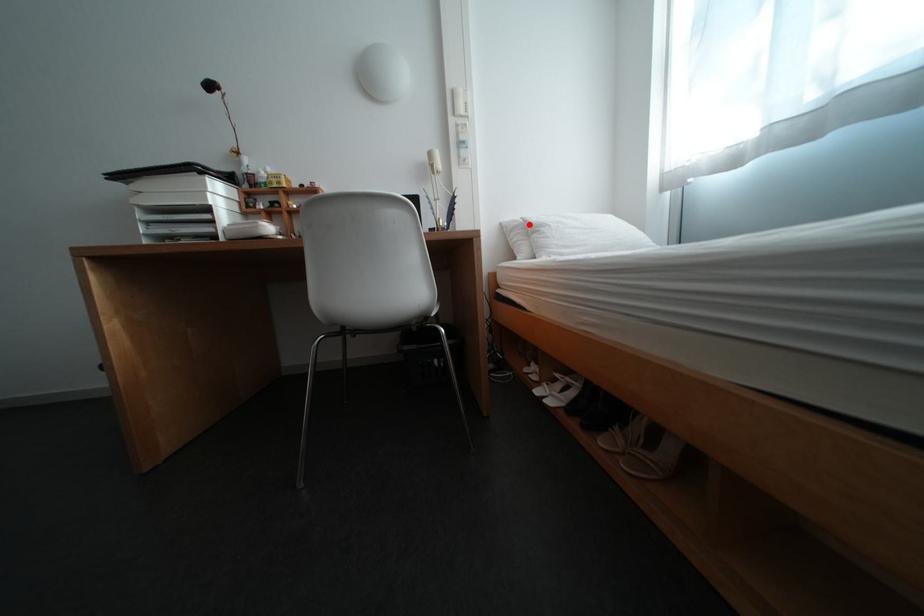
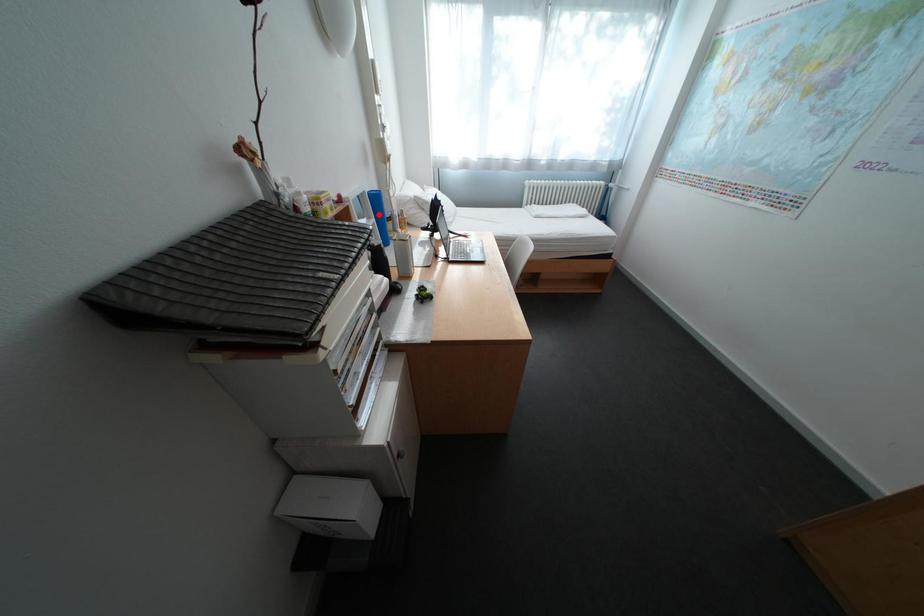
I am providing you with two images of the same scene from different viewpoints. A red point is marked on the first image and another point is marked on the second image. Is the red point in image1 aligned with the point shown in image2?

No